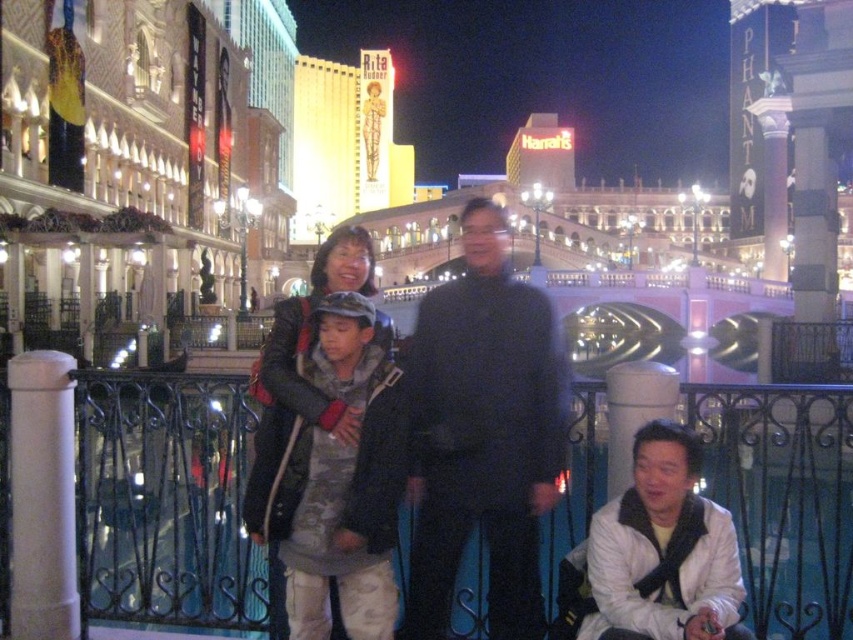
Question: Does white matte jacket at lower right have a greater width compared to leather jacket at center?

Choices:
 (A) no
 (B) yes

Answer: (A)

Question: Which point is farther to the camera?

Choices:
 (A) white matte jacket at lower right
 (B) leather jacket at center
 (C) black matte coat at center

Answer: (C)

Question: Which of the following is the farthest from the observer?

Choices:
 (A) (642, 598)
 (B) (268, 356)

Answer: (B)

Question: Does white matte jacket at lower right appear on the right side of leather jacket at center?

Choices:
 (A) no
 (B) yes

Answer: (B)

Question: Where is black matte coat at center located in relation to leather jacket at center in the image?

Choices:
 (A) left
 (B) right

Answer: (B)

Question: Which point is closer to the camera?

Choices:
 (A) (639, 518)
 (B) (357, 422)
 (C) (427, 573)

Answer: (A)